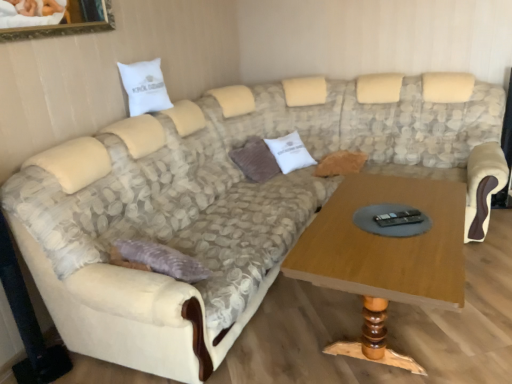
The image size is (512, 384). Identify the location of free spot above wooden coffee table at center (from a real-world perspective). (391, 208).